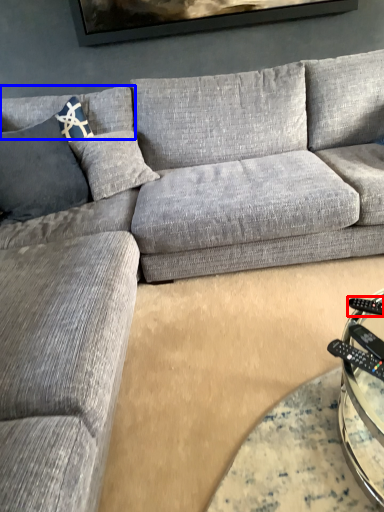
Question: Which object is further to the camera taking this photo, remote (highlighted by a red box) or pillow (highlighted by a blue box)?

Choices:
 (A) remote
 (B) pillow

Answer: (B)